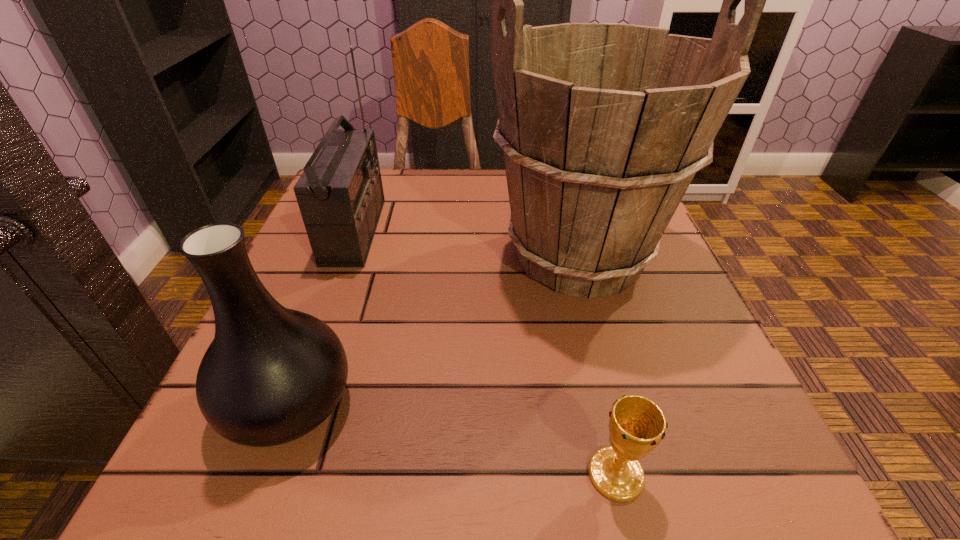
The height and width of the screenshot is (540, 960). In order to click on free space at the left edge of the desktop in this screenshot , I will do `click(372, 248)`.

This screenshot has width=960, height=540. What are the coordinates of `free space at the near left corner of the desktop` in the screenshot? It's located at (279, 461).

You are a GUI agent. You are given a task and a screenshot of the screen. Output one action in this format:
    pyautogui.click(x=<x>, y=<y>)
    Task: Click on the vacant space that is in between the third shortest object and the tallest object
    
    Given the screenshot: What is the action you would take?
    pyautogui.click(x=467, y=244)

The height and width of the screenshot is (540, 960). In order to click on empty space between the tallest object and the third shortest object in this screenshot , I will do `click(467, 244)`.

In order to click on vacant area between the bucket and the second shortest object in this screenshot , I will do `click(434, 329)`.

Find the location of a particular element. vacant space that's between the third shortest object and the vase is located at coordinates (323, 317).

Locate an element on the screen. The height and width of the screenshot is (540, 960). free space between the tallest object and the third tallest object is located at coordinates (434, 329).

At what (x,y) coordinates should I click in order to perform the action: click on free area in between the second tallest object and the second shortest object. Please return your answer as a coordinate pair (x, y). Looking at the image, I should click on (323, 317).

Identify the location of free space that is in between the chalice and the radio receiver. (486, 353).

Identify the location of vacant space in between the vase and the tallest object. [x=434, y=329].